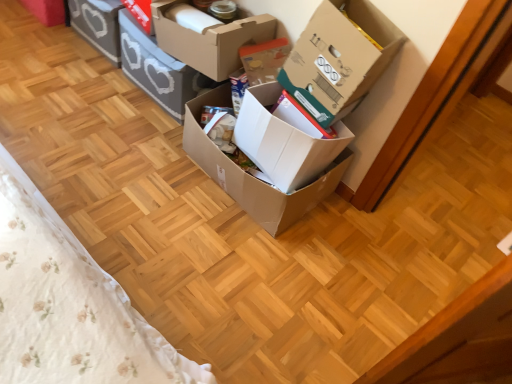
The image size is (512, 384). I want to click on vacant space to the right of brown cardboard box at center, the third box positioned from the right, so click(x=354, y=249).